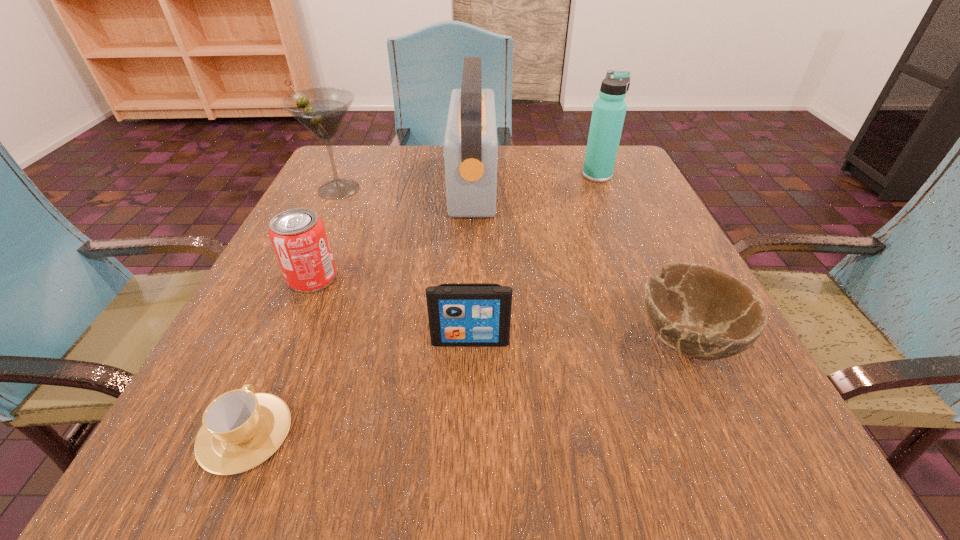
This screenshot has width=960, height=540. In order to click on free spot between the nearest object and the bowl in this screenshot , I will do `click(466, 386)`.

Find the location of a particular element. This screenshot has height=540, width=960. free spot between the bowl and the radio receiver is located at coordinates (579, 261).

Where is `empty location between the cup and the radio receiver`? empty location between the cup and the radio receiver is located at coordinates (359, 308).

Identify which object is the third nearest to the iPod. Please provide its 2D coordinates. Your answer should be formatted as a tuple, i.e. [(x, y)], where the tuple contains the x and y coordinates of a point satisfying the conditions above.

[(298, 236)]

At what (x,y) coordinates should I click in order to perform the action: click on object that can be found as the fifth closest to the nearest object. Please return your answer as a coordinate pair (x, y). The image size is (960, 540). Looking at the image, I should click on 322,110.

This screenshot has height=540, width=960. Identify the location of blank space that satisfies the following two spatial constraints: 1. on the front-facing side of the radio receiver; 2. on the front side of the martini. (472, 189).

Where is `vacant point that satisfies the following two spatial constraints: 1. on the front-facing side of the bowl; 2. on the left side of the radio receiver`? vacant point that satisfies the following two spatial constraints: 1. on the front-facing side of the bowl; 2. on the left side of the radio receiver is located at coordinates (468, 339).

Image resolution: width=960 pixels, height=540 pixels. I want to click on vacant space that satisfies the following two spatial constraints: 1. with the handle on the side of the nearest object; 2. on the left side of the thermos bottle, so click(357, 176).